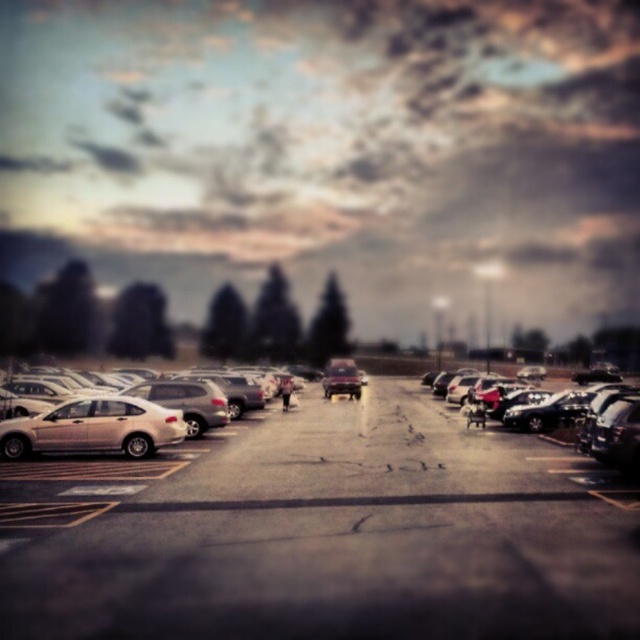
Question: Considering the relative positions of white matte car at center and shiny metallic car at center in the image provided, where is white matte car at center located with respect to shiny metallic car at center?

Choices:
 (A) left
 (B) right

Answer: (A)

Question: Can you confirm if white matte car at center is positioned to the left of satin silver sedan at left?

Choices:
 (A) no
 (B) yes

Answer: (A)

Question: Is silver metallic sedan at center-left wider than satin silver sedan at left?

Choices:
 (A) no
 (B) yes

Answer: (B)

Question: Which point is closer to the camera?

Choices:
 (A) satin silver sedan at left
 (B) shiny black sedan at center
 (C) silver metallic sedan at center-left

Answer: (B)

Question: Which object is positioned closest to the satin silver sedan at left?

Choices:
 (A) silver metallic sedan at center-left
 (B) shiny metallic car at center
 (C) shiny black sedan at center

Answer: (A)

Question: Estimate the real-world distances between objects in this image. Which object is closer to the shiny metallic car at center?

Choices:
 (A) shiny black sedan at center
 (B) satin silver sedan at left
 (C) white matte car at center
 (D) silver metallic sedan at center-left

Answer: (A)